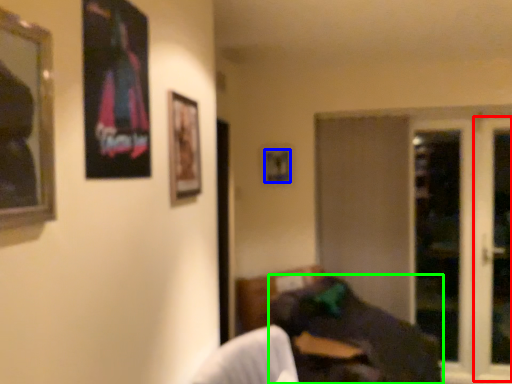
Question: Considering the real-world distances, which object is farthest from screen door (highlighted by a red box)? picture frame (highlighted by a blue box) or bean bag chair (highlighted by a green box)?

Choices:
 (A) picture frame
 (B) bean bag chair

Answer: (A)